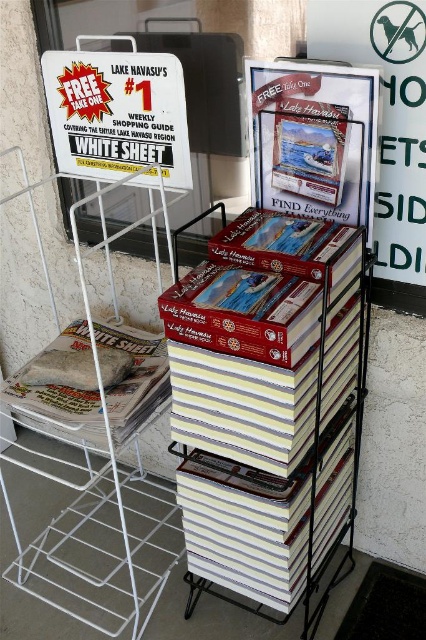
Looking at this image, you are a customer at the Lake Havasu display stand. You see the white paper sign at upper left and the white paper bag at lower left. Which object is closer to you?

The white paper sign at upper left is closer to you because it is in front of the white paper bag at lower left.

You are a tourist looking for the Lake Havasu shopping guide. You see a white paper sign at upper left and a matte plastic book at center. Which item is closer to the left side of the display stand?

The white paper sign at upper left is positioned on the left side of matte plastic book at center, so the white paper sign at upper left is closer to the left side of the display stand.